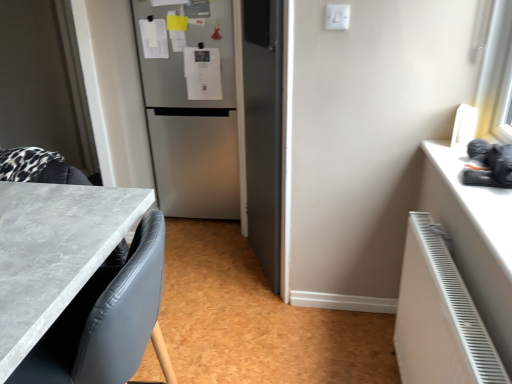
Question: Is the depth of stainless steel refrigerator at center less than that of white matte counter top at right?

Choices:
 (A) yes
 (B) no

Answer: (B)

Question: Is stainless steel refrigerator at center positioned far away from white matte counter top at right?

Choices:
 (A) yes
 (B) no

Answer: (A)

Question: Considering the relative positions of stainless steel refrigerator at center and white matte counter top at right in the image provided, is stainless steel refrigerator at center to the left of white matte counter top at right from the viewer's perspective?

Choices:
 (A) yes
 (B) no

Answer: (A)

Question: Considering the relative sizes of stainless steel refrigerator at center and white matte counter top at right in the image provided, is stainless steel refrigerator at center taller than white matte counter top at right?

Choices:
 (A) no
 (B) yes

Answer: (B)

Question: Does stainless steel refrigerator at center contain white matte counter top at right?

Choices:
 (A) yes
 (B) no

Answer: (B)

Question: Which is correct: stainless steel refrigerator at center is inside white matte radiator at lower right, or outside of it?

Choices:
 (A) inside
 (B) outside

Answer: (B)

Question: Is point (201, 43) closer or farther from the camera than point (406, 288)?

Choices:
 (A) closer
 (B) farther

Answer: (B)

Question: Relative to white matte radiator at lower right, is stainless steel refrigerator at center in front or behind?

Choices:
 (A) front
 (B) behind

Answer: (B)

Question: Based on their sizes in the image, would you say stainless steel refrigerator at center is bigger or smaller than white matte radiator at lower right?

Choices:
 (A) small
 (B) big

Answer: (B)

Question: Based on their positions, is white matte radiator at lower right located to the left or right of gray marble countertop at lower left?

Choices:
 (A) left
 (B) right

Answer: (B)

Question: From a real-world perspective, is white matte radiator at lower right positioned above or below gray marble countertop at lower left?

Choices:
 (A) below
 (B) above

Answer: (A)

Question: Choose the correct answer: Is white matte radiator at lower right inside gray marble countertop at lower left or outside it?

Choices:
 (A) inside
 (B) outside

Answer: (B)

Question: Is white matte radiator at lower right taller or shorter than gray marble countertop at lower left?

Choices:
 (A) tall
 (B) short

Answer: (B)

Question: From the image's perspective, is gray marble countertop at lower left above or below white matte counter top at right?

Choices:
 (A) above
 (B) below

Answer: (B)

Question: Is gray marble countertop at lower left wider or thinner than white matte counter top at right?

Choices:
 (A) thin
 (B) wide

Answer: (B)